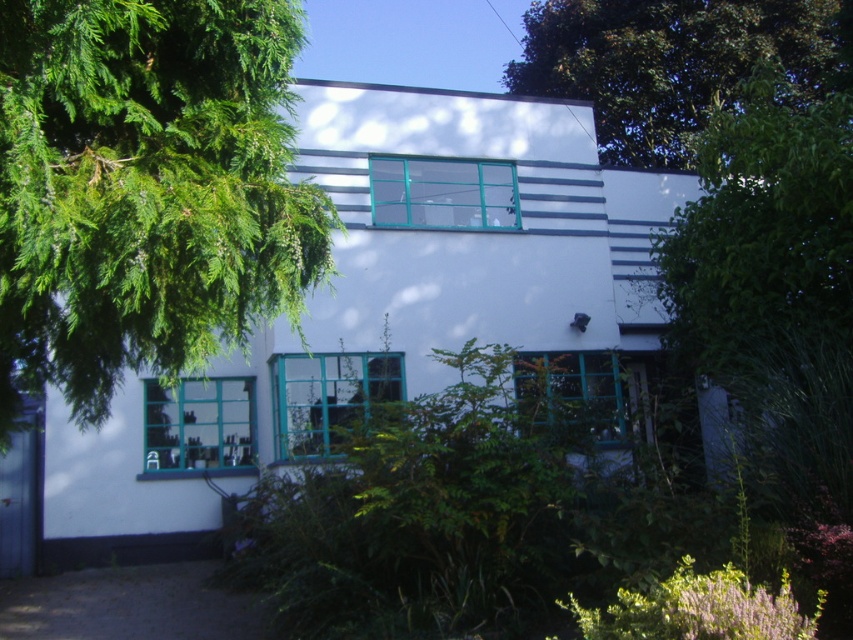
Question: From the image, what is the correct spatial relationship of green leafy branch at left in relation to green leafy tree at upper center?

Choices:
 (A) right
 (B) left

Answer: (B)

Question: Estimate the real-world distances between objects in this image. Which object is farther from the green leafy tree at upper center?

Choices:
 (A) green leafy branch at left
 (B) green leafy tree at right

Answer: (A)

Question: Among these objects, which one is nearest to the camera?

Choices:
 (A) green leafy tree at upper center
 (B) green leafy branch at left

Answer: (B)

Question: Does green leafy tree at right have a greater width compared to green leafy tree at upper center?

Choices:
 (A) yes
 (B) no

Answer: (B)

Question: Is green leafy tree at right further to the viewer compared to green leafy tree at upper center?

Choices:
 (A) no
 (B) yes

Answer: (A)

Question: Among these points, which one is farthest from the camera?

Choices:
 (A) 825,356
 (B) 86,403

Answer: (A)